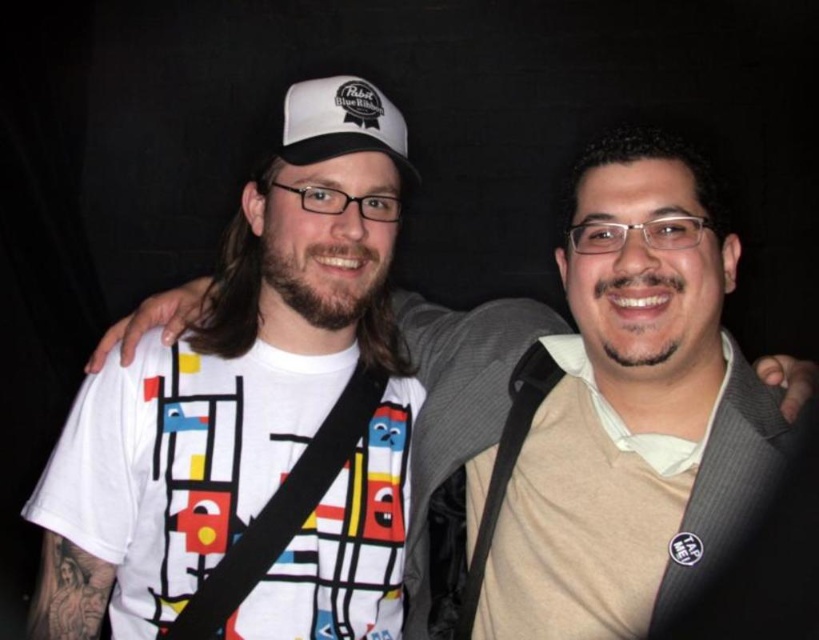
In the scene shown: You are a photographer trying to capture a portrait of the two people in the scene. You notice the white fabric cap at center and the black fabric strap at upper center. Which object should you focus on first if you want to ensure both are in sharp focus, considering their sizes?

You should focus on the white fabric cap at center first because it is larger than the black fabric strap at upper center, making it easier to achieve sharp focus on the larger object, ensuring both are in focus.

You are a photographer trying to capture a portrait of the two people in the scene. The camera you are using has a depth of field that can focus on objects within a 20 inch range. If you focus on the white fabric cap at center, will the black fabric strap at upper center also be in focus?

The distance between the white fabric cap at center and the black fabric strap at upper center is 19.74 inches, which is within the 20 inch range of the camera. Therefore, both objects will be in focus.